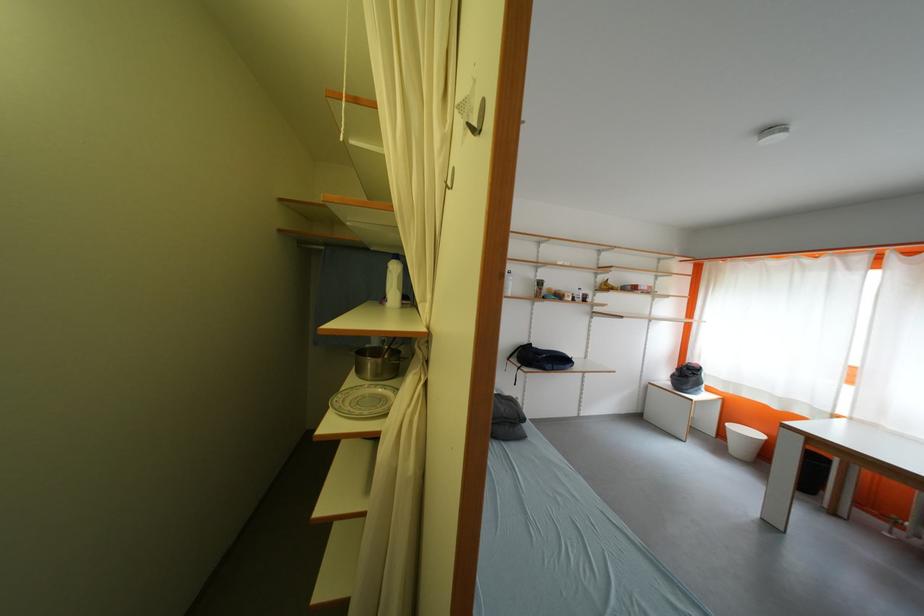
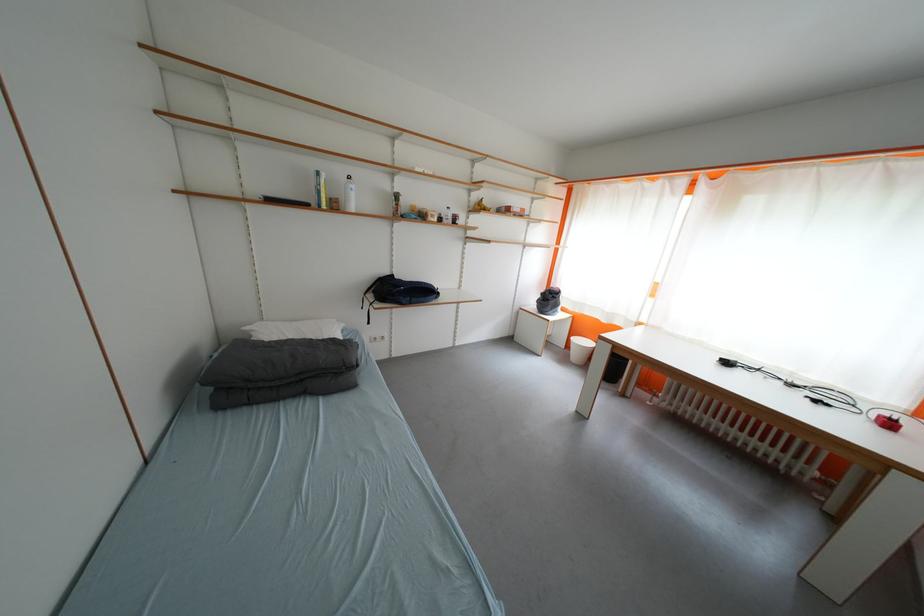
Which direction would the cameraman need to move to produce the second image?

The cameraman moved toward right, forward.